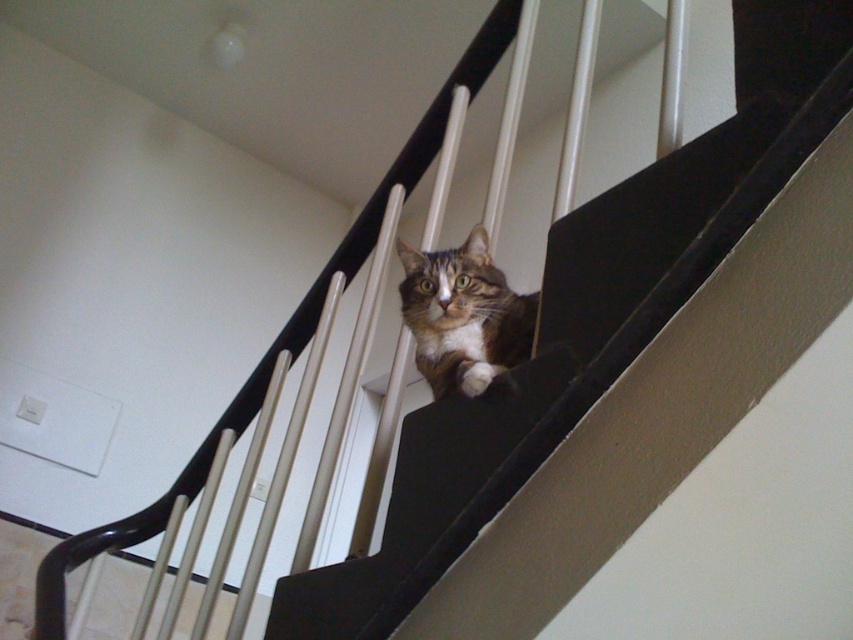
Is brown furry cat at center taller than brown fur cat at center?

Indeed, brown furry cat at center has a greater height compared to brown fur cat at center.

Who is positioned more to the right, brown furry cat at center or brown fur cat at center?

brown furry cat at center is more to the right.

Who is more distant from viewer, (796, 84) or (479, 360)?

The point (479, 360) is more distant.

The height and width of the screenshot is (640, 853). In order to click on brown furry cat at center in this screenshot , I will do `click(590, 317)`.